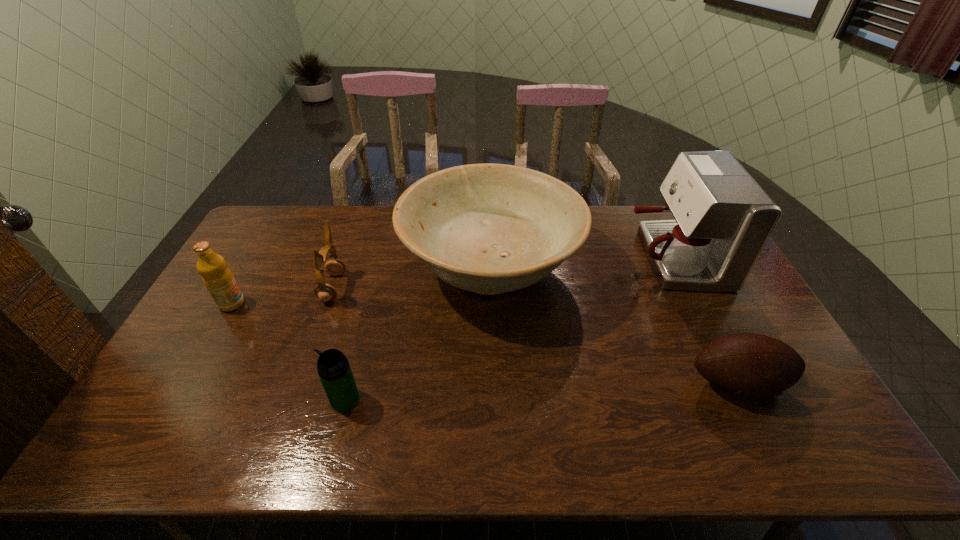
Find the location of a particular element. The height and width of the screenshot is (540, 960). vacant space located 0.320m on the front label of the fruit juice is located at coordinates (348, 303).

Where is `vacant space located 0.340m on the front-facing side of the earphone`? This screenshot has height=540, width=960. vacant space located 0.340m on the front-facing side of the earphone is located at coordinates (449, 287).

Image resolution: width=960 pixels, height=540 pixels. Find the location of `vacant space located from the spout of the thermos bottle`. vacant space located from the spout of the thermos bottle is located at coordinates (212, 399).

I want to click on vacant area located 0.310m from the spout of the thermos bottle, so click(x=208, y=399).

Find the location of a particular element. The height and width of the screenshot is (540, 960). vacant point located from the spout of the thermos bottle is located at coordinates (271, 399).

Identify the location of free region located 0.060m on the laces of the football. (762, 433).

The image size is (960, 540). In order to click on coffee maker that is at the far edge in this screenshot , I will do `click(723, 219)`.

Locate an element on the screen. The image size is (960, 540). dish present at the far edge is located at coordinates (488, 228).

Find the location of a particular element. The height and width of the screenshot is (540, 960). object located at the left edge is located at coordinates (217, 277).

Find the location of `coffee maker that is at the right edge`. coffee maker that is at the right edge is located at coordinates (723, 219).